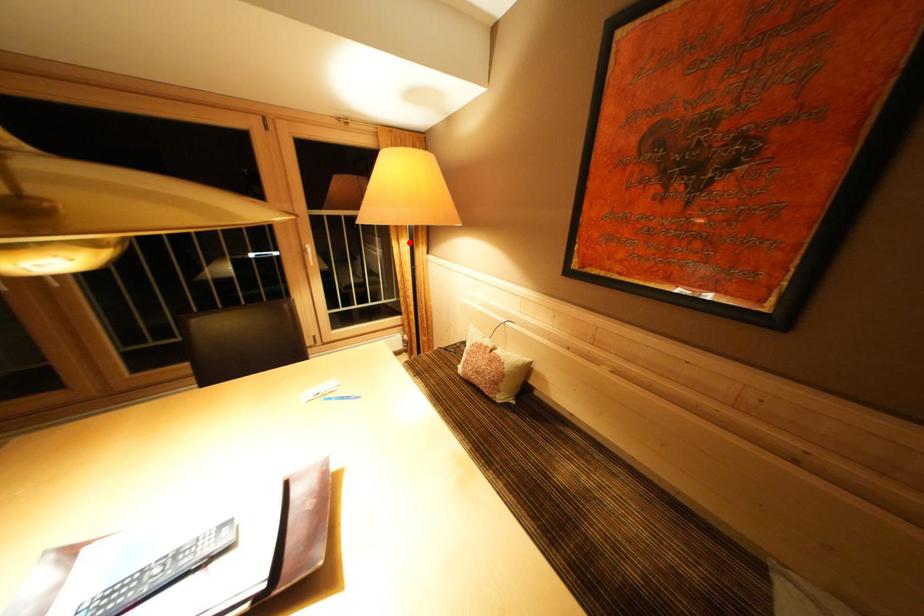
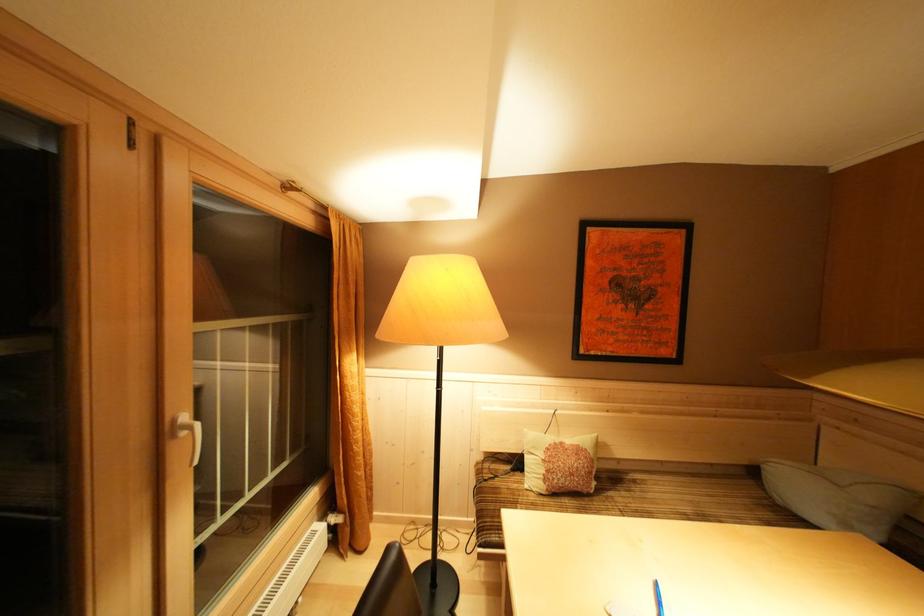
Where in the second image is the point corresponding to the highlighted location from the first image?

(358, 357)